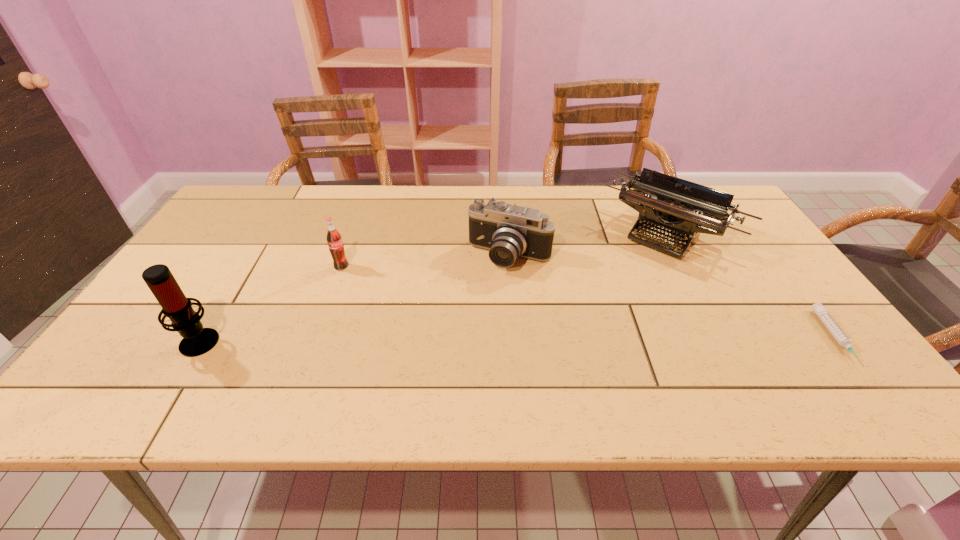
Where is `vacant area that lies between the camera and the typewriter`? vacant area that lies between the camera and the typewriter is located at coordinates (589, 244).

You are a GUI agent. You are given a task and a screenshot of the screen. Output one action in this format:
    pyautogui.click(x=<x>, y=<y>)
    Task: Click on the object that stands as the closest to the camera
    The width and height of the screenshot is (960, 540).
    Given the screenshot: What is the action you would take?
    pyautogui.click(x=681, y=208)

Where is `object that is the closest to the soda bottle`? This screenshot has height=540, width=960. object that is the closest to the soda bottle is located at coordinates (x=197, y=340).

Image resolution: width=960 pixels, height=540 pixels. Identify the location of vacant point that satisfies the following two spatial constraints: 1. on the back side of the camera; 2. on the left side of the fourth object from right to left. point(345,257).

This screenshot has height=540, width=960. Find the location of `vacant area that satisfies the following two spatial constraints: 1. on the back side of the second object from right to left; 2. on the left side of the second object from left to right`. vacant area that satisfies the following two spatial constraints: 1. on the back side of the second object from right to left; 2. on the left side of the second object from left to right is located at coordinates (354, 231).